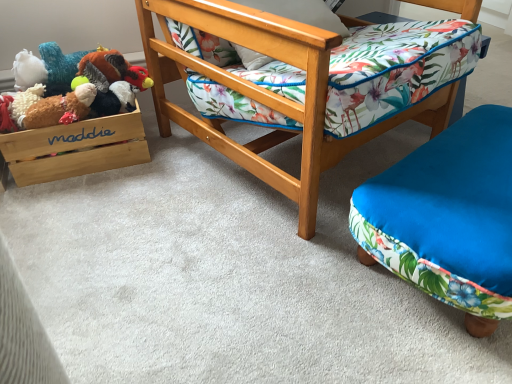
At what (x,y) coordinates should I click in order to perform the action: click on unoccupied area in front of wooden chair at center. Please return your answer as a coordinate pair (x, y). The height and width of the screenshot is (384, 512). Looking at the image, I should click on (234, 286).